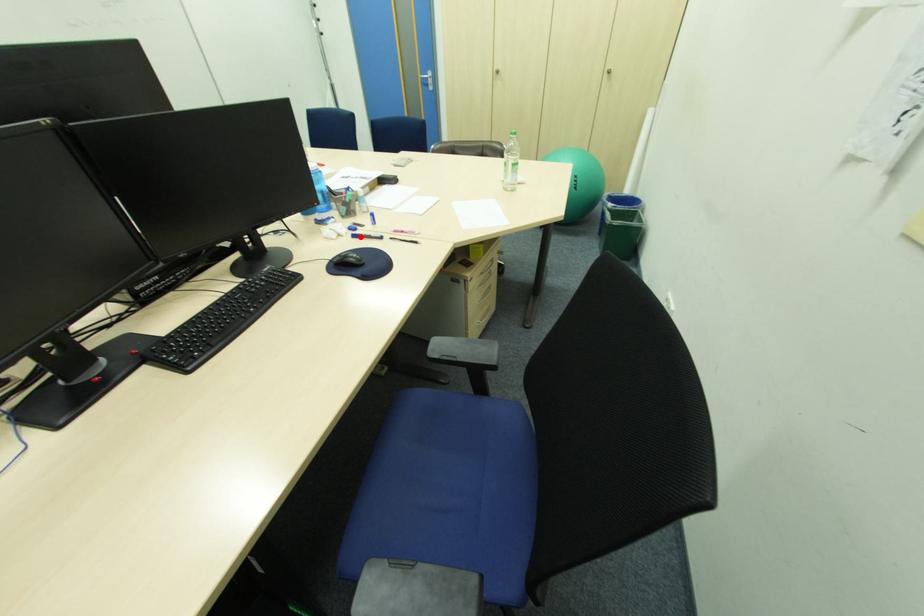
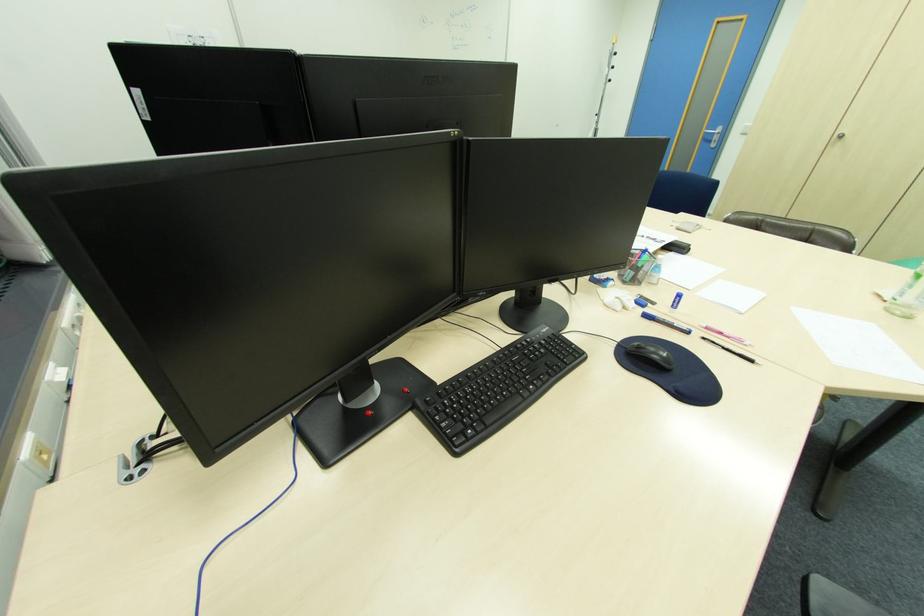
The point at the highlighted location is marked in the first image. Where is the corresponding point in the second image?

(651, 315)